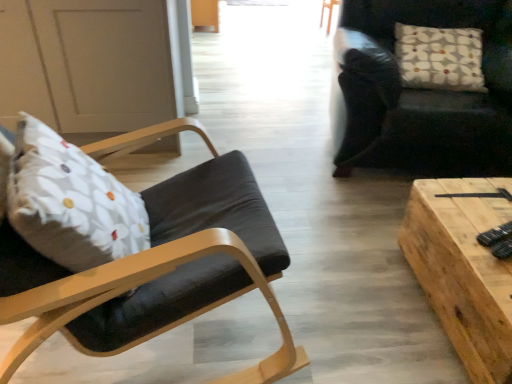
You are a GUI agent. You are given a task and a screenshot of the screen. Output one action in this format:
    pyautogui.click(x=<x>, y=<y>)
    Task: Click on the free spot to the left of black plastic remote control at lower right
    This screenshot has width=512, height=384.
    Given the screenshot: What is the action you would take?
    pyautogui.click(x=460, y=233)